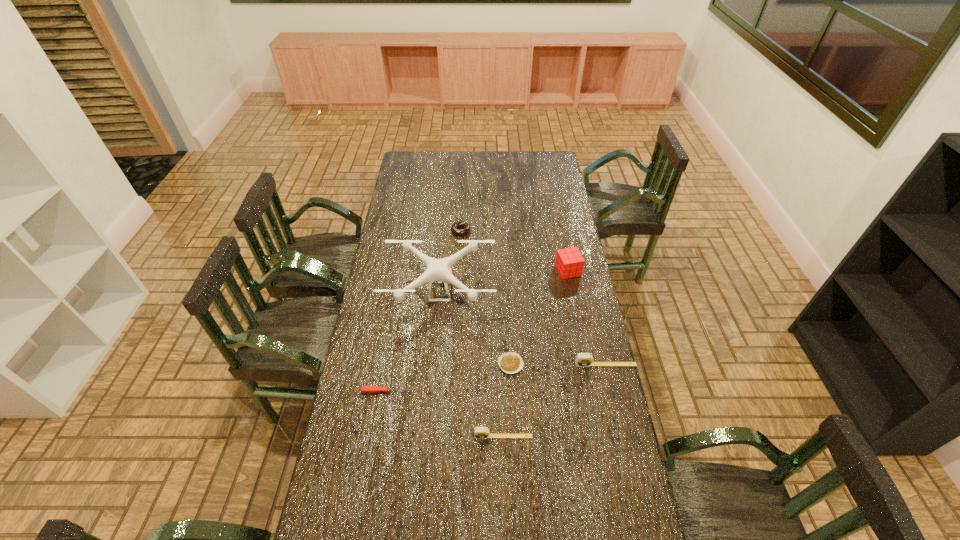
Locate an element on the screen. The image size is (960, 540). tape measure at the right edge is located at coordinates (582, 359).

At what (x,y) coordinates should I click in order to perform the action: click on cube positioned at the right edge. Please return your answer as a coordinate pair (x, y). This screenshot has width=960, height=540. Looking at the image, I should click on (569, 262).

Where is `free space at the far edge`? The image size is (960, 540). free space at the far edge is located at coordinates (479, 154).

Locate an element on the screen. Image resolution: width=960 pixels, height=540 pixels. free space at the near edge of the desktop is located at coordinates (476, 524).

This screenshot has width=960, height=540. Identify the location of vacant space at the left edge. (411, 185).

Image resolution: width=960 pixels, height=540 pixels. Identify the location of vacant space at the right edge of the desktop. (567, 286).

The image size is (960, 540). What are the coordinates of `vacant area that lies between the screwdriver and the nearest object` in the screenshot? It's located at (445, 414).

Identify the location of free space between the cube and the drone. coord(504,281).

Find the location of a particular element. This screenshot has width=960, height=540. empty location between the shortest object and the nearest object is located at coordinates (507, 400).

Locate an element on the screen. free spot between the shorter tape measure and the third tallest object is located at coordinates (554, 401).